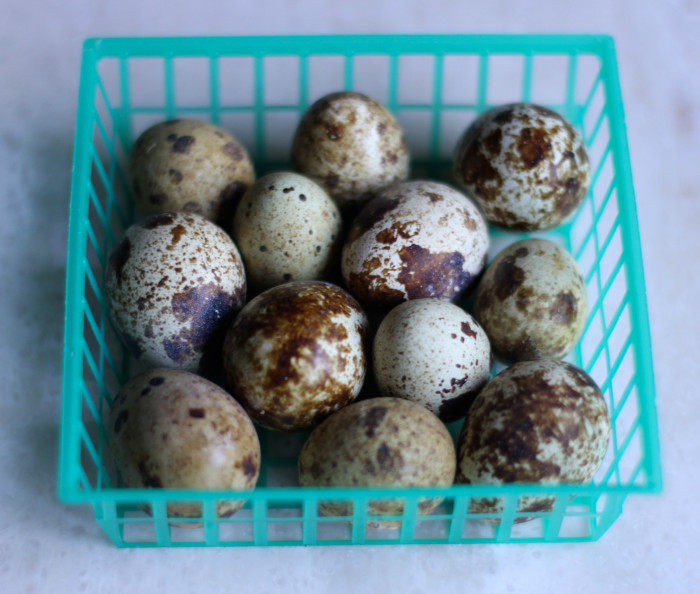
This screenshot has width=700, height=594. Identify the location of bottom right corner of basket. (654, 491).